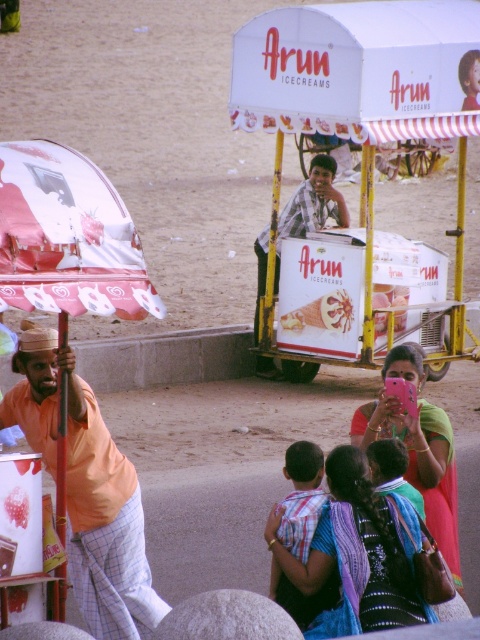
What are the coordinates of the white cardboard cart at center?

The white cardboard cart at center is located at coordinates (361,96).

You are a photographer trying to capture both the blue fabric sari at lower center and the matte pink phone at center in a single frame. Based on their positions, which object should you adjust your camera angle to focus on first to ensure both are in the frame?

The blue fabric sari at lower center is shorter than the matte pink phone at center, so you should focus on the matte pink phone at center first to ensure both objects are captured in the frame.

You are a customer looking to buy an ice cream from the vendor. You see the white cardboard cart at center and the matte pink phone at center. Which one is positioned to the right of the other?

The white cardboard cart at center is to the right of the matte pink phone at center.